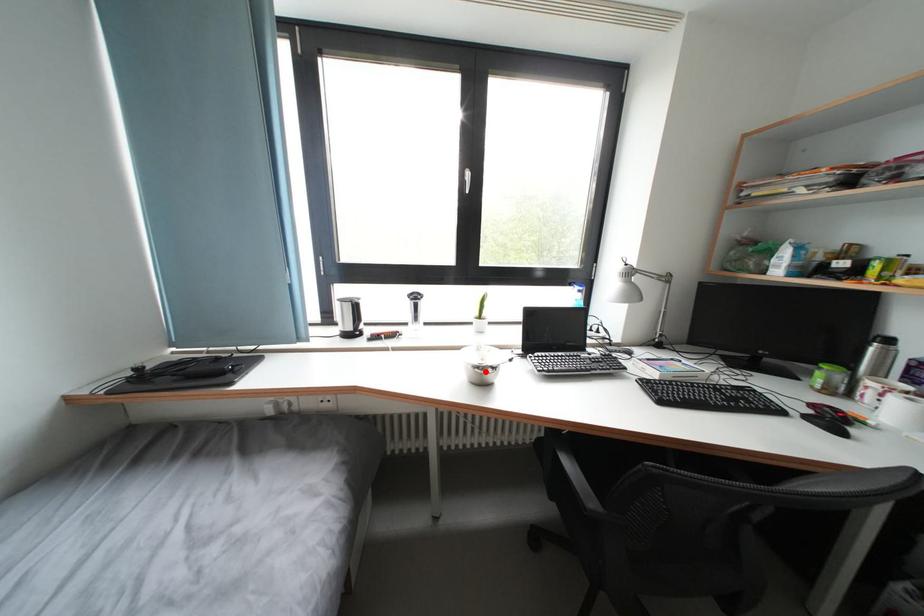
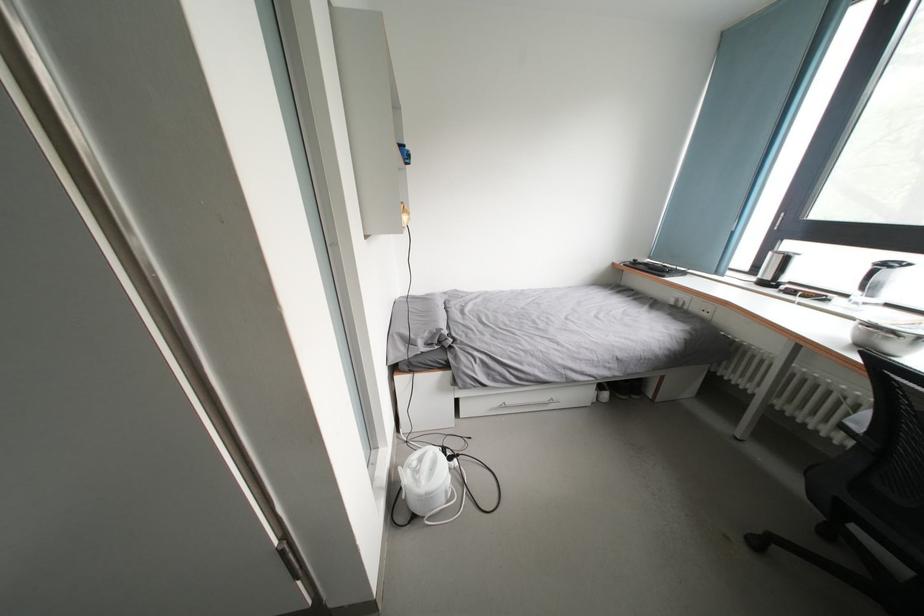
In the second image, find the point that corresponds to the highlighted location in the first image.

(877, 331)